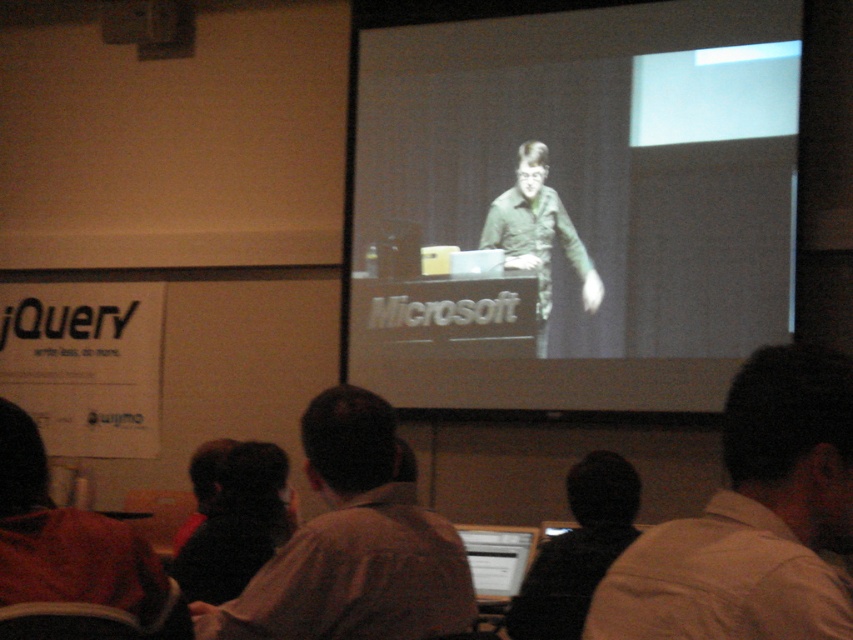
You are organizing a photo shoot for a clothing brand and need to arrange two models wearing light brown shirts. The first model is wearing the light brown shirt at lower right and the second model is wearing the light brown shirt at center. Based on the scene description, which model should you place closer to the camera to ensure the shirt appears more prominent in the final photo?

The light brown shirt at center should be placed closer to the camera because it is thicker than the light brown shirt at lower right, making it appear more prominent when positioned nearer to the camera.

You are standing in the audience and want to see the speaker clearly. The speaker is at the podium with a laptop. There is a light brown shirt at lower right represented by point (753,518). Is the light brown shirt at lower right blocking your view of the speaker?

The light brown shirt at lower right is represented by point (753,518), which is located at the lower right of the image. Since the speaker is at the podium on stage, the light brown shirt at lower right is likely positioned behind or to the side of the audience member, so it is not blocking the view of the speaker.

You are an event organizer checking the stage setup. You notice the light brown shirt at center and the black fuzzy hat at lower center. Which object is positioned more to the left side of the image?

The light brown shirt at center is positioned more to the left side of the image than the black fuzzy hat at lower center.